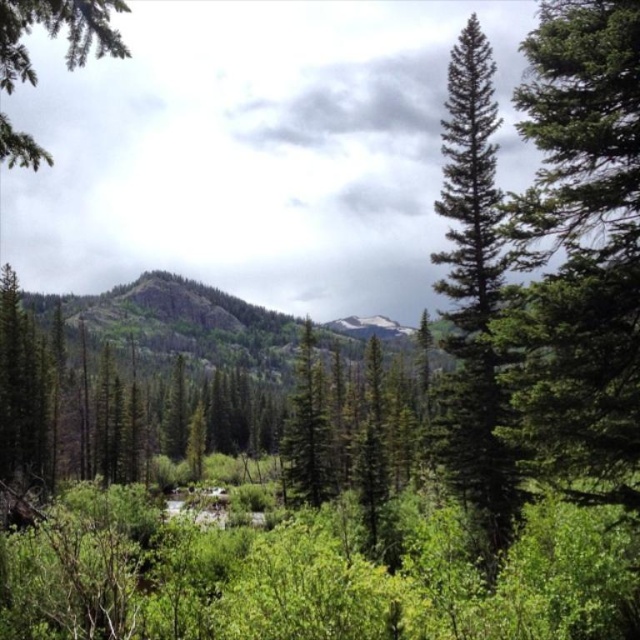
You are standing in the forest scene and want to walk from your current position to a point closer to the foreground. Which point should you head towards, point (490, 474) or point (380, 333)?

You should head towards point (490, 474) because it is closer to the viewer than point (380, 333) according to the description.